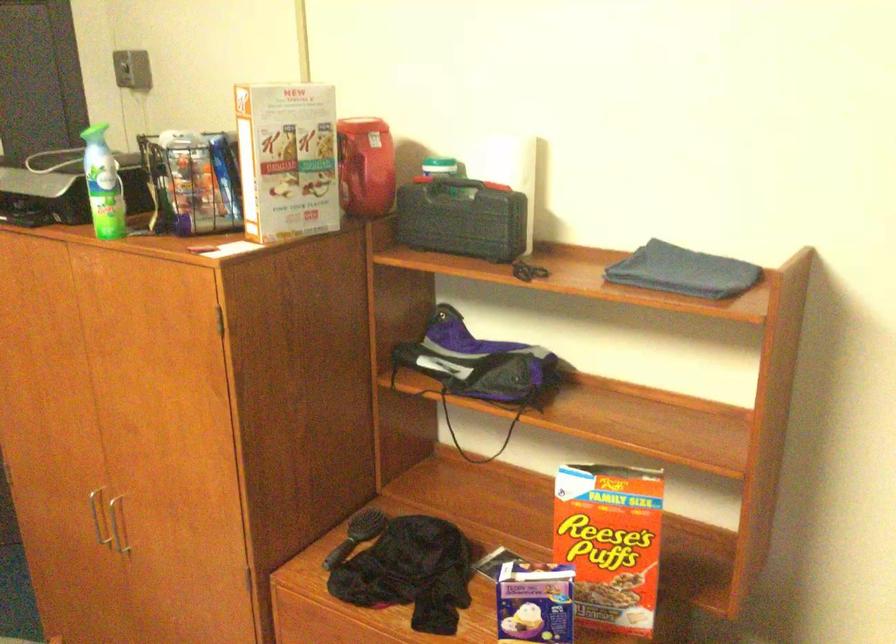
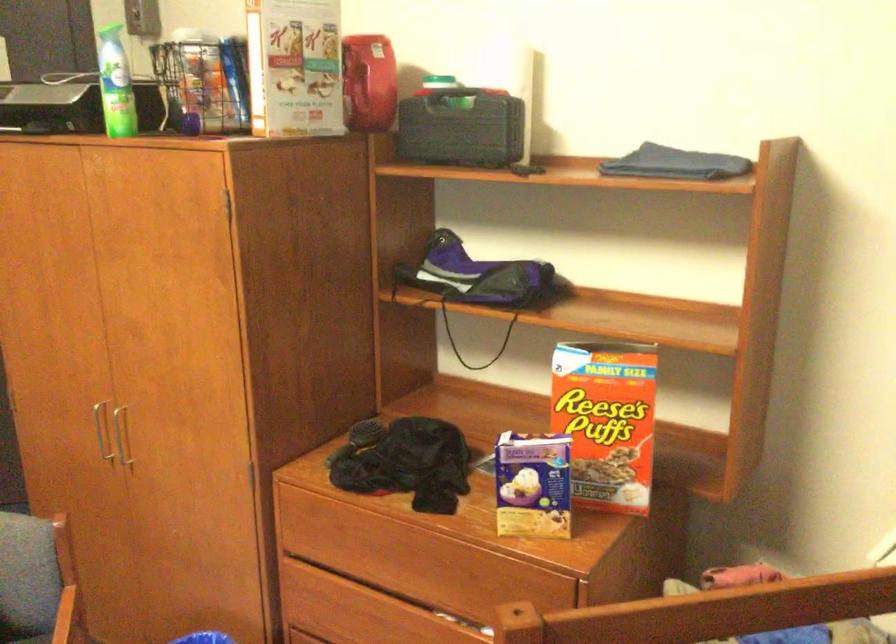
In the second image, find the point that corresponds to pixel 99 518 in the first image.

(100, 431)